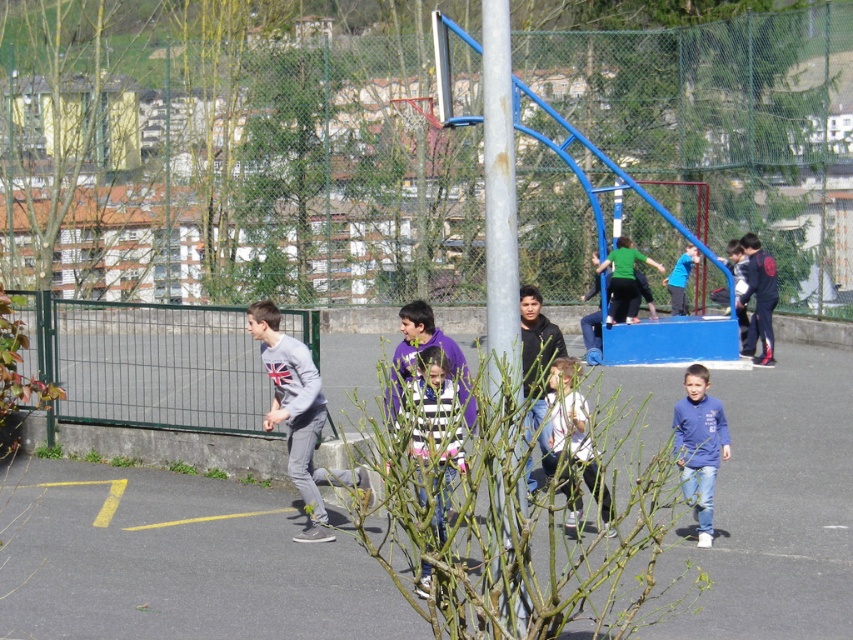
Is blue fleece jacket at center to the right of white matte jacket at center from the viewer's perspective?

Indeed, blue fleece jacket at center is positioned on the right side of white matte jacket at center.

Does blue fleece jacket at center have a greater width compared to white matte jacket at center?

→ Correct, the width of blue fleece jacket at center exceeds that of white matte jacket at center.

Identify the location of blue fleece jacket at center. (699, 445).

Which is more to the right, blue fleece jacket at center or dark blue hoodie at center?

Positioned to the right is dark blue hoodie at center.

Can you confirm if blue fleece jacket at center is positioned to the right of dark blue hoodie at center?

Incorrect, blue fleece jacket at center is not on the right side of dark blue hoodie at center.

Which is behind, point (701, 536) or point (776, 291)?

Point (776, 291)

I want to click on blue fleece jacket at center, so click(x=699, y=445).

Can you confirm if white matte jacket at center is positioned to the left of black matte jacket at center?

Incorrect, white matte jacket at center is not on the left side of black matte jacket at center.

Looking at this image, between white matte jacket at center and black matte jacket at center, which one has more height?

black matte jacket at center is taller.

Is point (581, 417) less distant than point (535, 483)?

Yes, it is in front of point (535, 483).

Locate an element on the screen. white matte jacket at center is located at coordinates (567, 422).